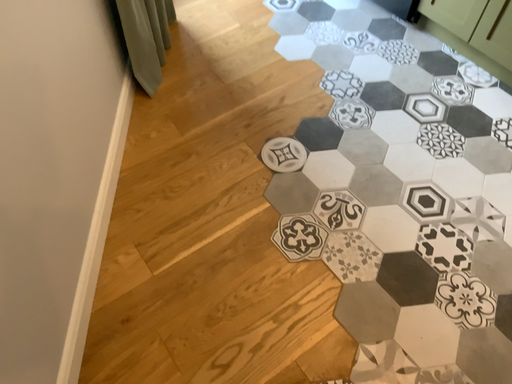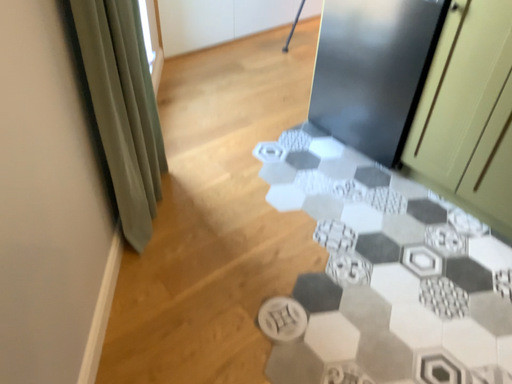
Question: Which way did the camera rotate in the video?

Choices:
 (A) rotated downward
 (B) rotated upward

Answer: (B)